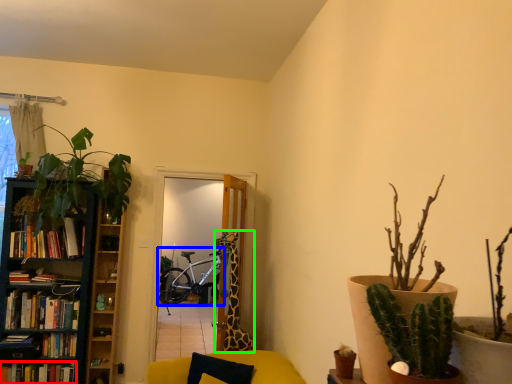
Question: Estimate the real-world distances between objects in this image. Which object is closer to book (highlighted by a red box), bicycle (highlighted by a blue box) or giraffe (highlighted by a green box)?

Choices:
 (A) bicycle
 (B) giraffe

Answer: (B)